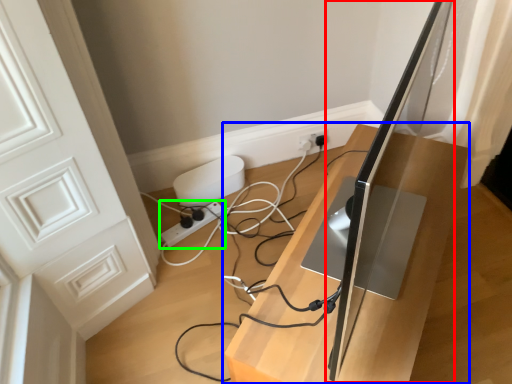
Question: Considering the real-world distances, which object is farthest from computer monitor (highlighted by a red box)? furniture (highlighted by a blue box) or extension cord (highlighted by a green box)?

Choices:
 (A) furniture
 (B) extension cord

Answer: (B)